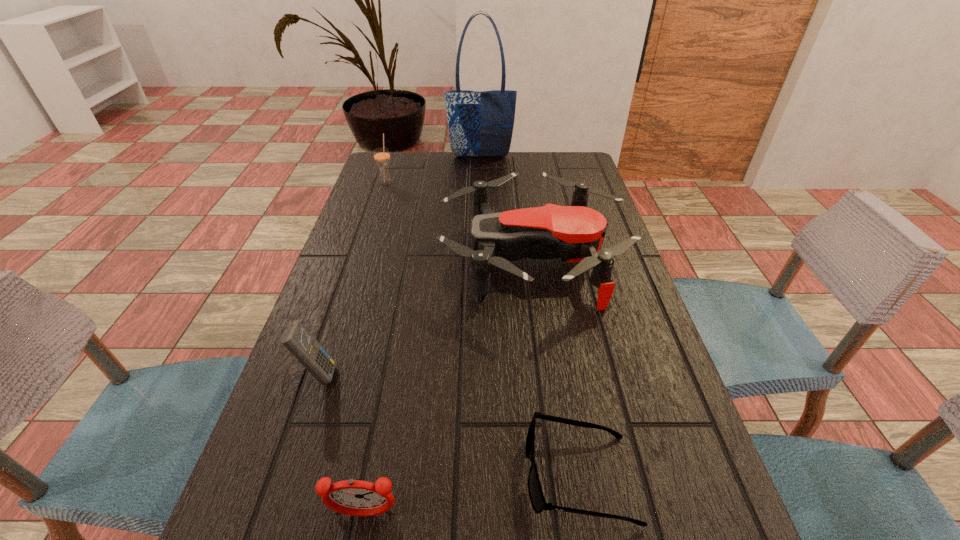
Locate an element on the screen. The width and height of the screenshot is (960, 540). alarm clock that is at the left edge is located at coordinates (351, 497).

Locate an element on the screen. This screenshot has width=960, height=540. drone that is positioned at the right edge is located at coordinates (575, 233).

The width and height of the screenshot is (960, 540). Identify the location of sunglasses that is at the right edge. (536, 495).

Find the location of a particular element. Image resolution: width=960 pixels, height=540 pixels. object that is at the far left corner is located at coordinates (381, 155).

This screenshot has width=960, height=540. I want to click on vacant space at the far edge of the desktop, so click(466, 171).

The width and height of the screenshot is (960, 540). In the image, there is a desktop. In order to click on vacant region at the left edge in this screenshot , I will do `click(344, 329)`.

Where is `vacant space at the right edge of the desktop`? Image resolution: width=960 pixels, height=540 pixels. vacant space at the right edge of the desktop is located at coordinates (564, 267).

Locate an element on the screen. vacant position at the far left corner of the desktop is located at coordinates (405, 159).

Identify the location of vacant point located between the alarm clock and the straw. (375, 349).

Where is `unoccupied position between the third nearest object and the shopping bag`? The image size is (960, 540). unoccupied position between the third nearest object and the shopping bag is located at coordinates (399, 265).